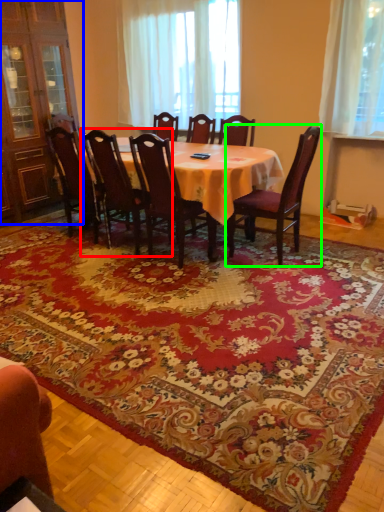
Question: Which is farther away from chair (highlighted by a red box)? armoire (highlighted by a blue box) or chair (highlighted by a green box)?

Choices:
 (A) armoire
 (B) chair

Answer: (A)